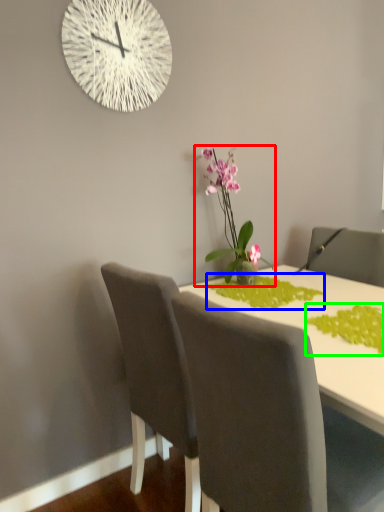
Question: Which object is positioned closest to houseplant (highlighted by a red box)? Select from plant (highlighted by a blue box) and plant (highlighted by a green box).

Choices:
 (A) plant
 (B) plant

Answer: (A)